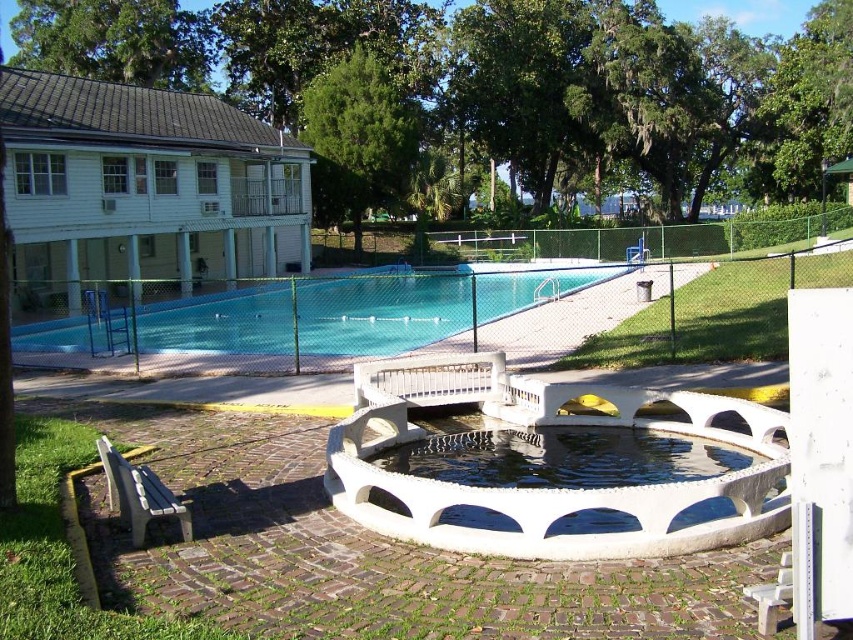
Can you confirm if white smooth fountain at center is positioned to the left of blue smooth pool at center?

In fact, white smooth fountain at center is to the right of blue smooth pool at center.

Which is in front, point (498, 547) or point (99, 323)?

Point (498, 547) is in front.

You are a GUI agent. You are given a task and a screenshot of the screen. Output one action in this format:
    pyautogui.click(x=<x>, y=<y>)
    Task: Click on the white smooth fountain at center
    
    Given the screenshot: What is the action you would take?
    pyautogui.click(x=548, y=486)